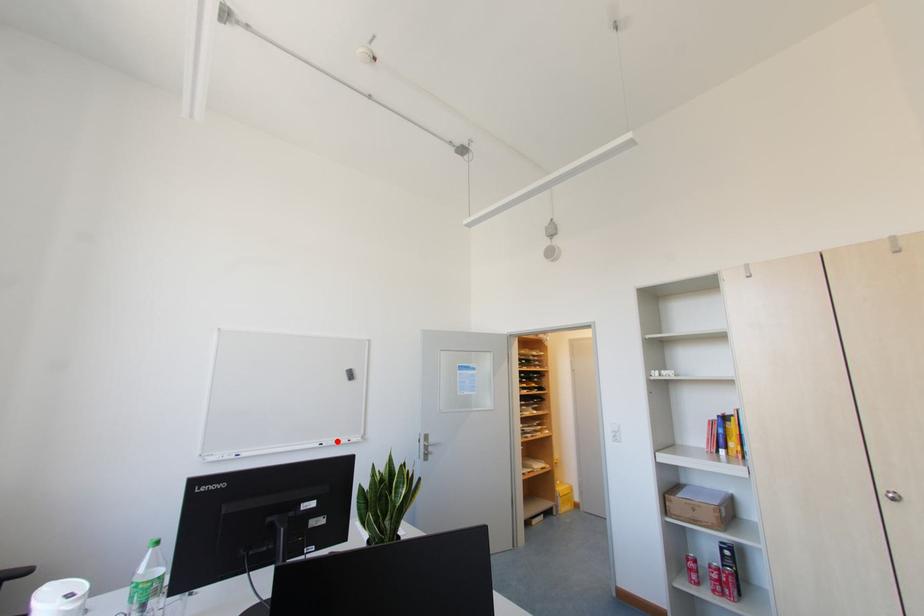
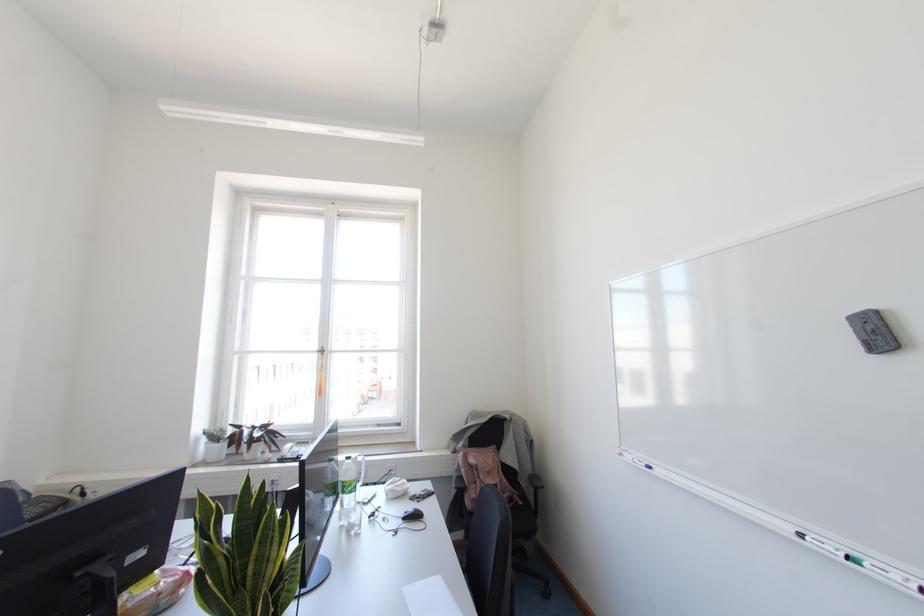
The point at the highlighted location is marked in the first image. Where is the corresponding point in the second image?

(866, 565)